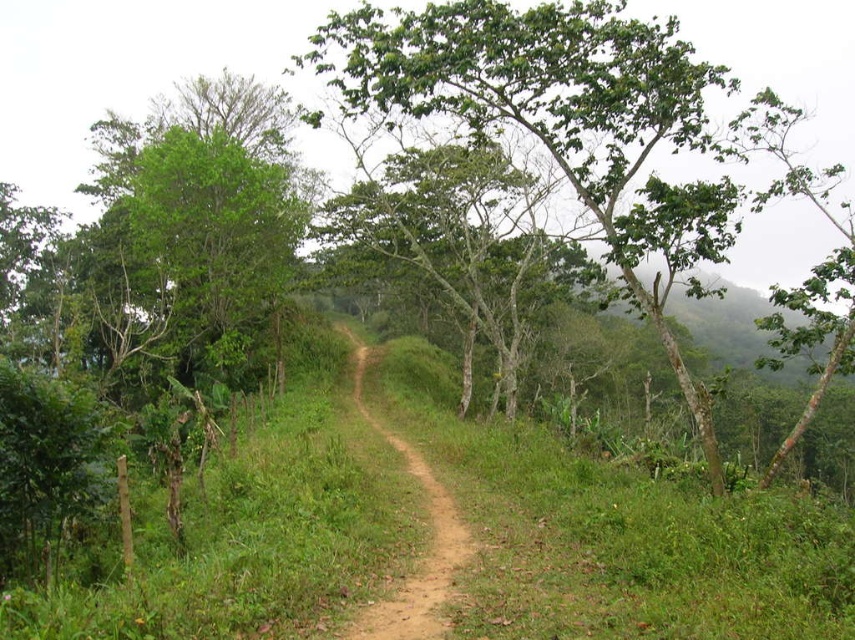
You are a hiker standing at the starting point of the dirt path in the rural scene. You see two points marked on the path ahead of you. The first point is at coordinates point [608,211] and the second is at point [355,387]. Which point is closer to your current position?

Point [608,211] is in front of point [355,387], so the first point is closer to your current position.

You are a hiker planning to walk along the brown dirt track at center. You notice the green leafy tree at center nearby. Which one occupies more space in the image?

The green leafy tree at center is bigger than the brown dirt track at center, so the tree occupies more space in the image.

You are a hiker trying to navigate a narrow path. You see a green leafy tree at center and a brown dirt track at center. Which one is wider?

The green leafy tree at center is wider than the brown dirt track at center according to the description.